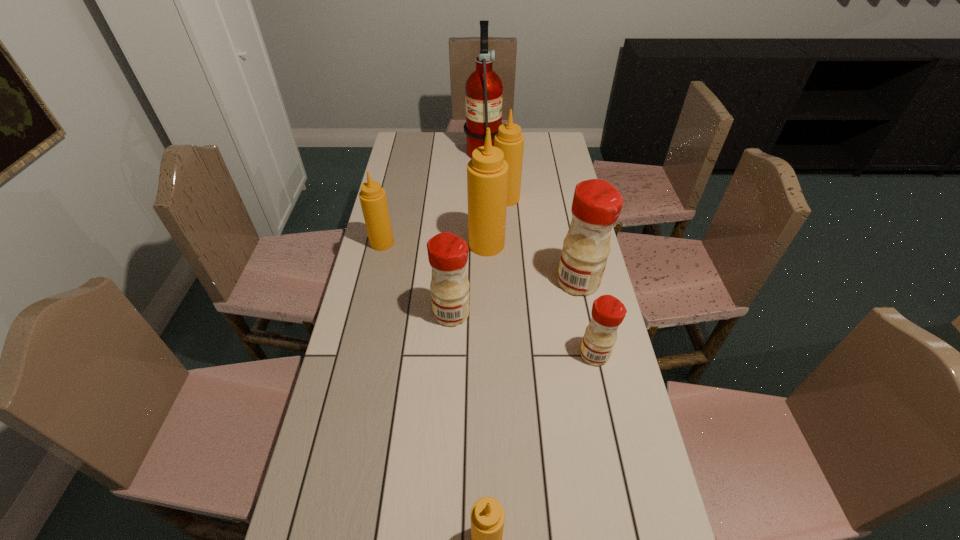
This screenshot has height=540, width=960. Find the location of `fire extinguisher`. fire extinguisher is located at coordinates (483, 90).

I want to click on the tallest condiment, so click(487, 172).

I want to click on the biggest tan condiment, so click(x=487, y=172).

The height and width of the screenshot is (540, 960). In order to click on the second farthest object in this screenshot , I will do `click(509, 139)`.

Image resolution: width=960 pixels, height=540 pixels. Find the location of `the farthest tan condiment`. the farthest tan condiment is located at coordinates (509, 139).

The image size is (960, 540). Identify the location of the farthest red condiment. (597, 204).

Where is `the fifth farthest object`? the fifth farthest object is located at coordinates (597, 204).

The width and height of the screenshot is (960, 540). I want to click on the leftmost tan condiment, so click(x=372, y=196).

I want to click on the third biggest tan condiment, so click(372, 196).

At what (x,y) coordinates should I click in order to perform the action: click on the second smallest red condiment. Please return your answer as a coordinate pair (x, y). The width and height of the screenshot is (960, 540). Looking at the image, I should click on (448, 253).